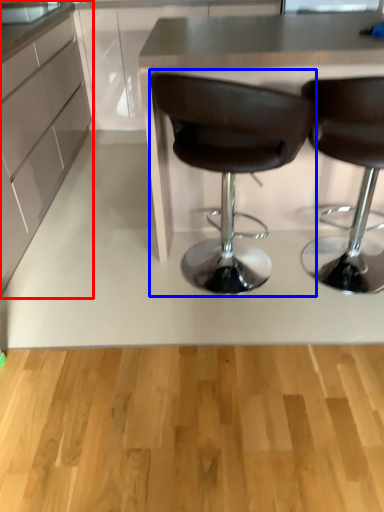
Question: Which of the following is the closest to the observer, cabinetry (highlighted by a red box) or chair (highlighted by a blue box)?

Choices:
 (A) cabinetry
 (B) chair

Answer: (B)